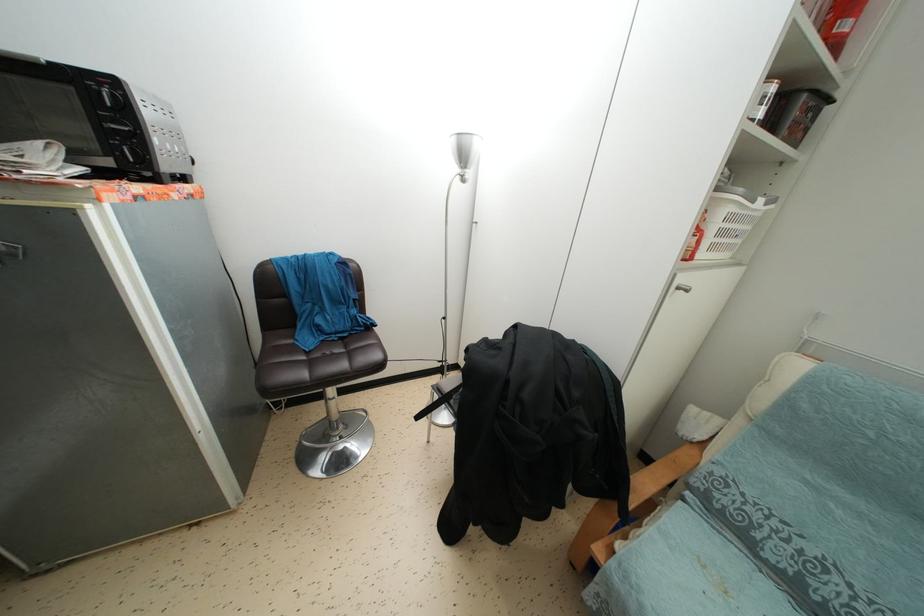
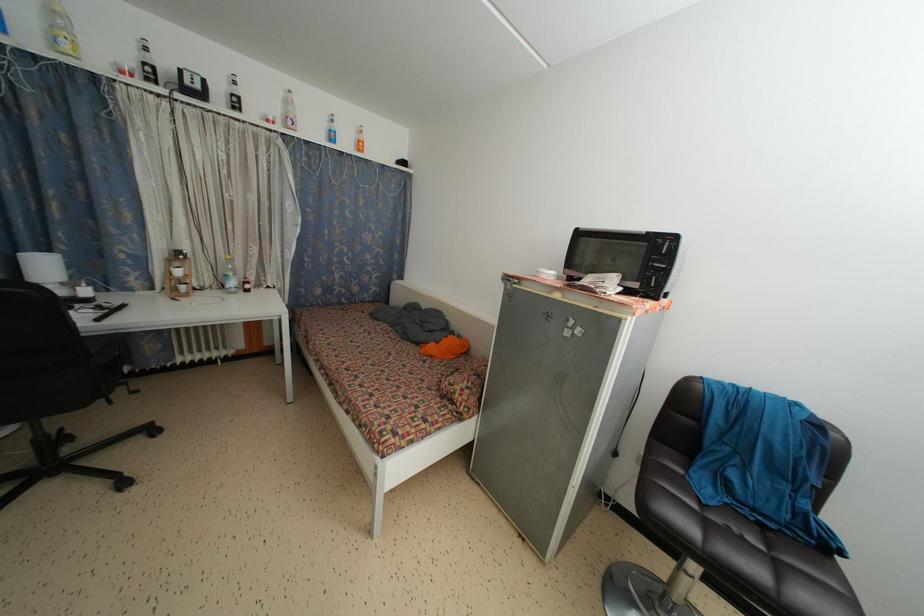
Find the pixel in the second image that matches [107,138] in the first image.

(650, 273)